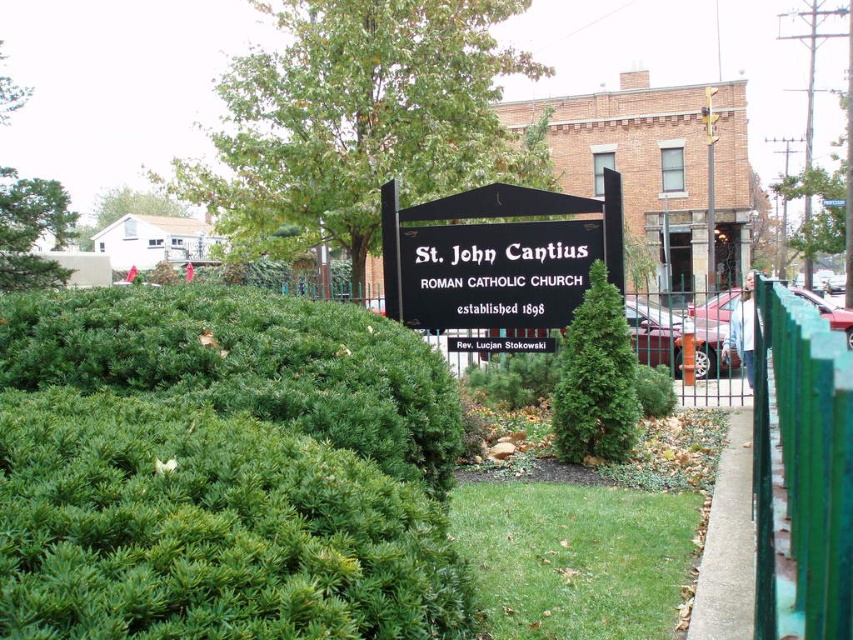
You are a visitor approaching the entrance of St. John Cantius Roman Catholic Church. You notice a green leafy hedge at center and a black matte sign at center. Which object is taller?

The green leafy hedge at center has a lesser height compared to black matte sign at center, so the black matte sign at center is taller.

A visitor wants to take a photo of both the green painted wood fence at right and the green textured bush at center from a distance where both can be fully captured in the frame. If the camera has a maximum focal length that allows capturing objects up to 10 feet apart, will they be able to do so?

The green painted wood fence at right is 9.03 feet from the green textured bush at center, which is within the camera maximum focal length of 10 feet. Therefore, the visitor can take a photo of both objects from that distance.

You are standing at the entrance of St. John Cantius Roman Catholic Church. You see a green leafy hedge represented by point (223, 470). Where is this point located relative to the entrance?

The green leafy hedge at center is represented by point (223, 470), so the point is located at the center of the entrance area.